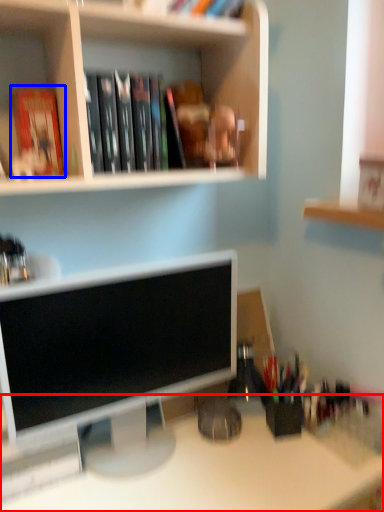
Question: Among these objects, which one is farthest to the camera, desk (highlighted by a red box) or paperback book (highlighted by a blue box)?

Choices:
 (A) desk
 (B) paperback book

Answer: (B)